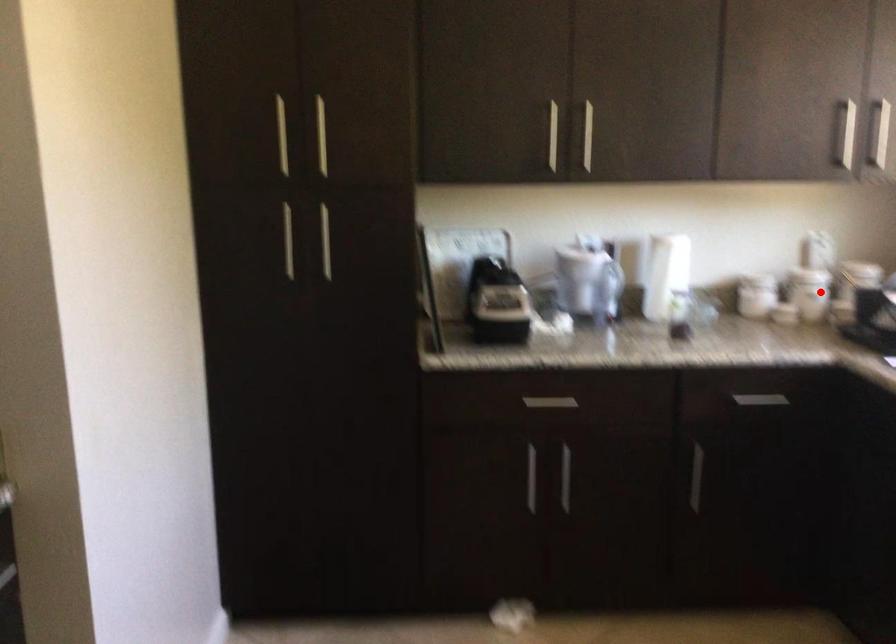
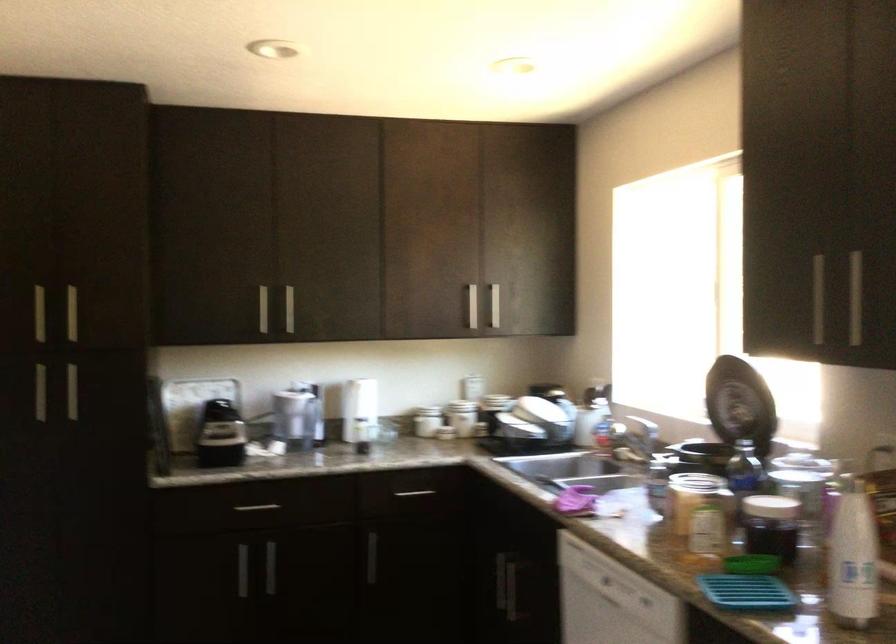
Locate, in the second image, the point that corresponds to the highlighted location in the first image.

(461, 417)